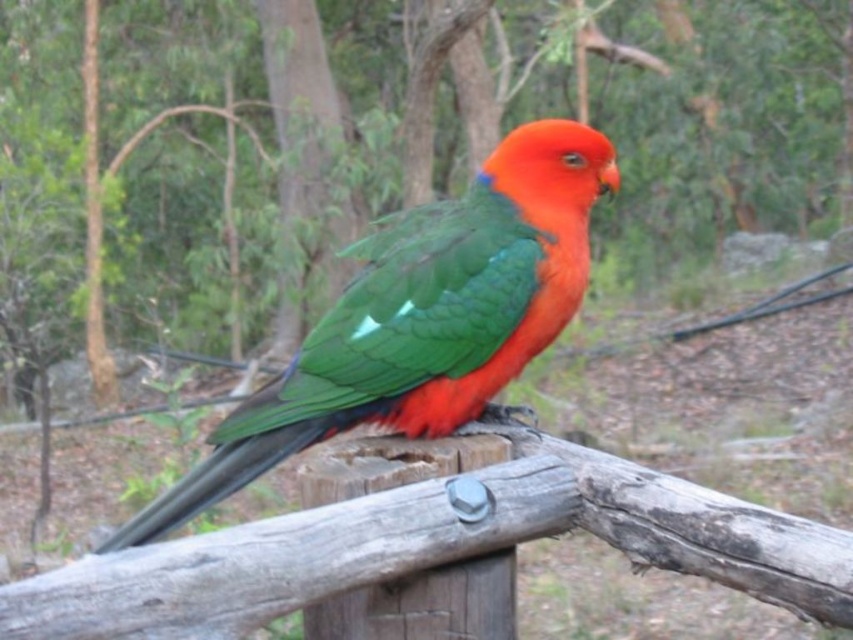
You are a birdwatcher observing the scene. You notice the wooden post at center and the shiny green parrot at center. Which object has a greater height in this image?

The shiny green parrot at center is taller than the wooden post at center, as stated in the description.

You are a birdwatcher observing the scene. You notice the wooden post at center and the shiny green parrot at center. Which object is located higher in the image?

The wooden post at center is positioned over the shiny green parrot at center, so the wooden post at center is higher.

You are a birdwatcher observing the scene. You notice the wooden post at center and the shiny green parrot at center. From your perspective, which object is located to the right?

The shiny green parrot at center is located to the right of the wooden post at center.